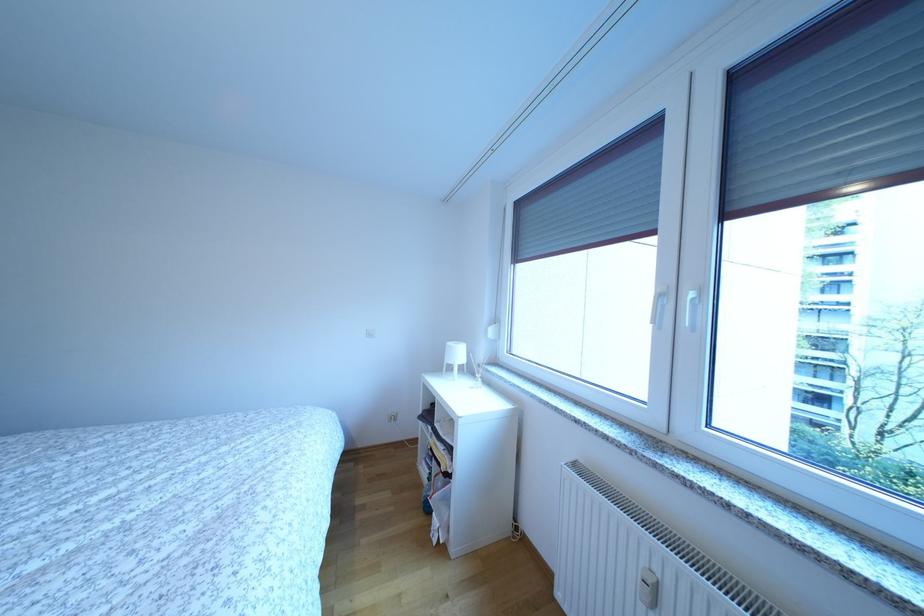
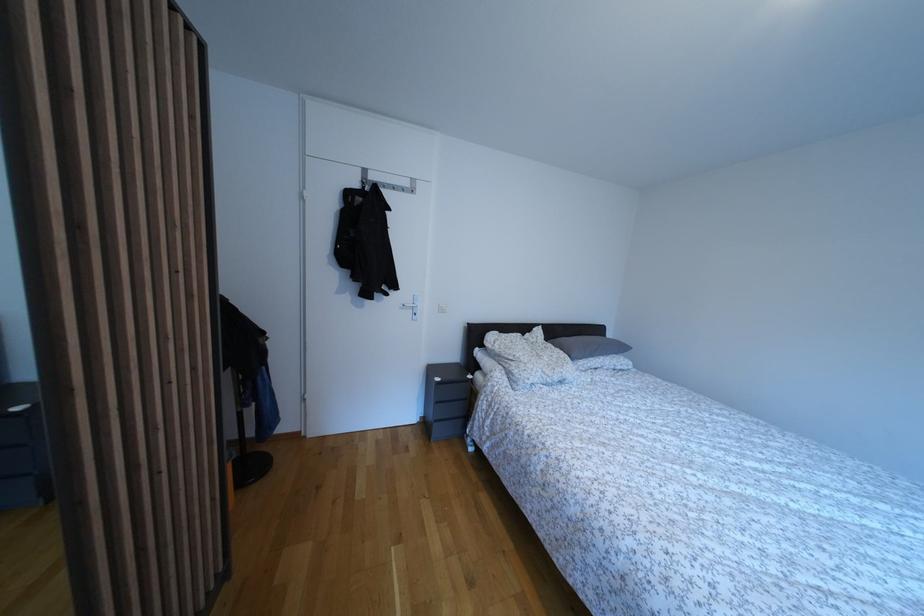
Question: The camera is either moving clockwise (left) or counter-clockwise (right) around the object. The first image is from the beginning of the video and the second image is from the end. Is the camera moving left or right when shooting the video?

Choices:
 (A) Left
 (B) Right

Answer: (B)